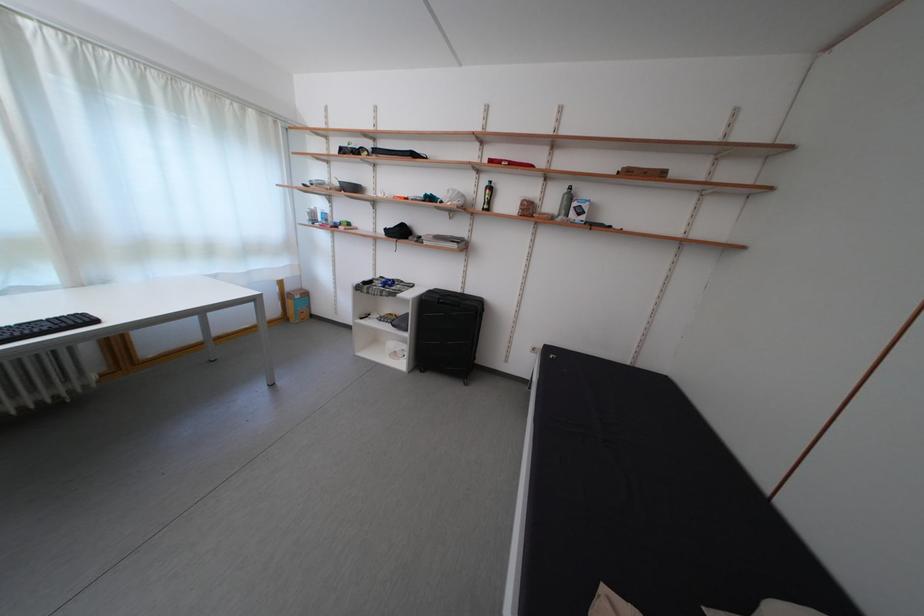
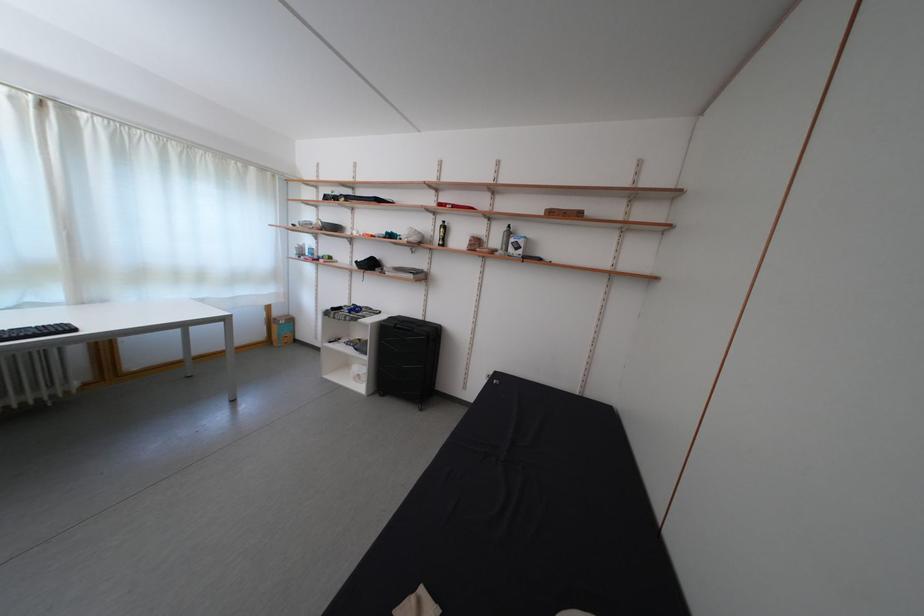
Locate, in the second image, the point that corresponds to pixel 329 179 in the first image.

(319, 221)